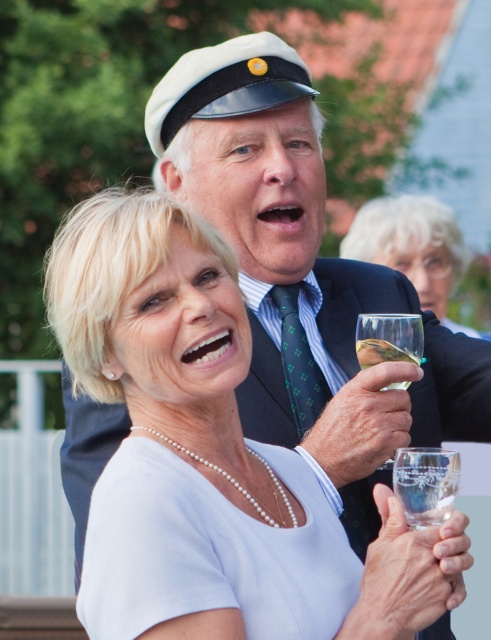
You are a bartender at a party and need to place two glasses on a shelf. You have a transparent glass at upper center and a clear glass at lower right. Which glass should you place on the left side of the shelf to match their current positions?

The clear glass at lower right should be placed on the left side of the shelf because the transparent glass at upper center is positioned to its right in the current scene, so maintaining that arrangement would require placing the clear glass at lower right on the left.

You are standing in the scene and want to pick up the clear glass at lower right. Where should you look to find it?

The clear glass at lower right is located at the 2D coordinates point (426, 492).